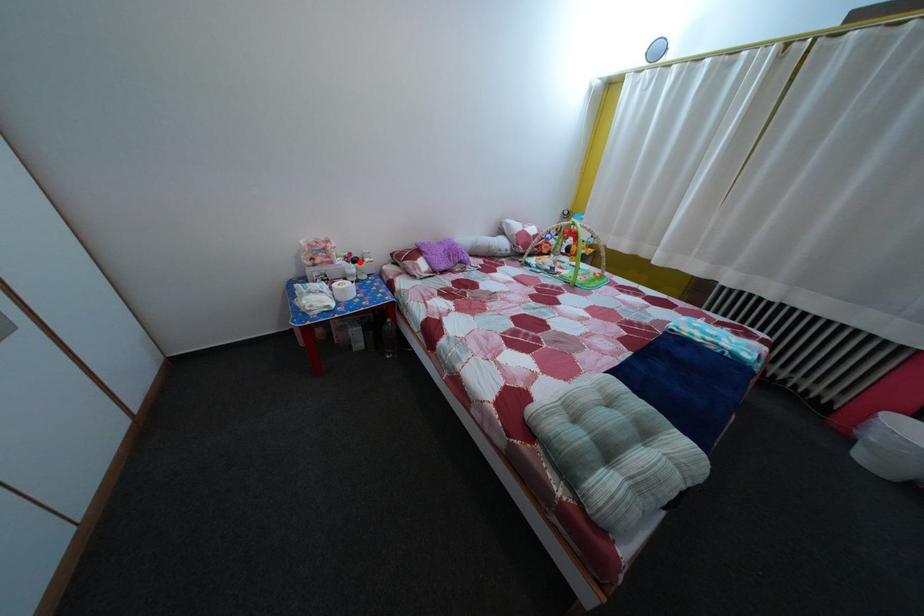
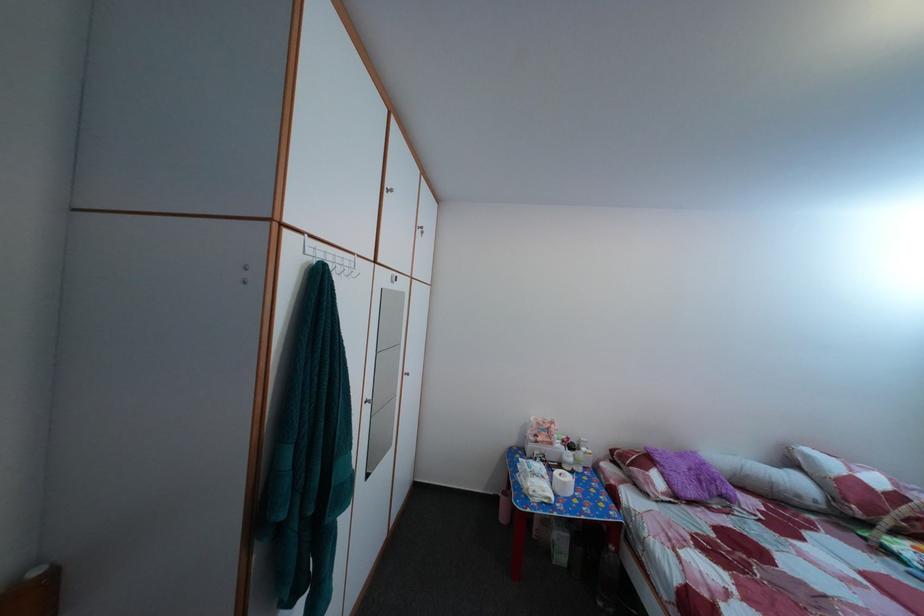
The point at the highlighted location is marked in the first image. Where is the corresponding point in the second image?

(578, 447)